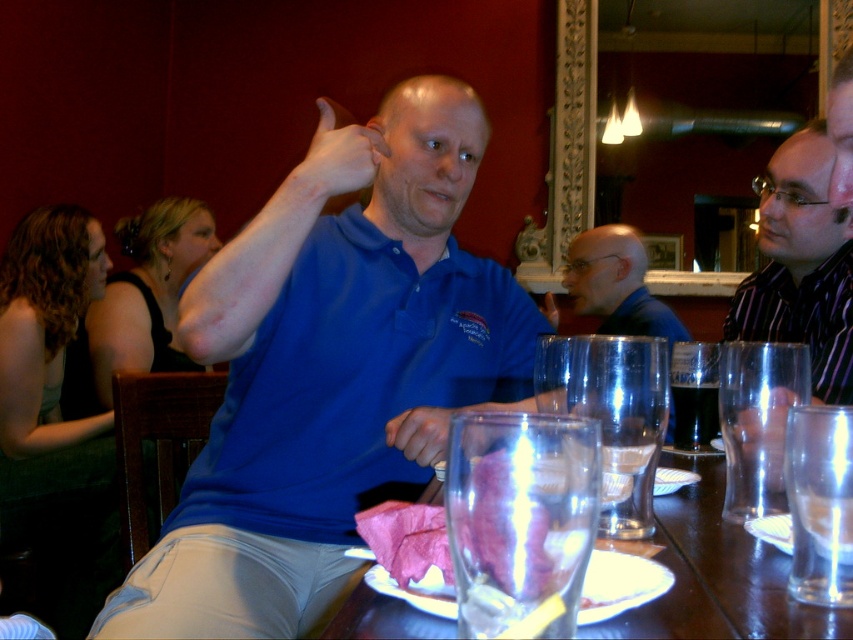
Is point (450, 522) closer to camera compared to point (585, 236)?

Yes, point (450, 522) is closer to viewer.

Which is behind, point (517, 429) or point (572, 252)?

Positioned behind is point (572, 252).

In order to click on transparent glass at center in this screenshot , I will do `click(520, 520)`.

In the scene shown: Does transparent glass at table right come behind blue shirt at center?

No, transparent glass at table right is in front of blue shirt at center.

Is transparent glass at table right to the right of blue shirt at center from the viewer's perspective?

No, transparent glass at table right is not to the right of blue shirt at center.

Is point (802, 432) more distant than point (642, 248)?

No, (802, 432) is in front of (642, 248).

Find the location of a particular element. transparent glass at table right is located at coordinates (820, 502).

Which is more to the left, blue cotton shirt at center or pink matte meat at center?

From the viewer's perspective, blue cotton shirt at center appears more on the left side.

Who is more forward, (289, 291) or (538, 579)?

Point (538, 579) is more forward.

Find the location of a particular element. blue cotton shirt at center is located at coordinates (329, 371).